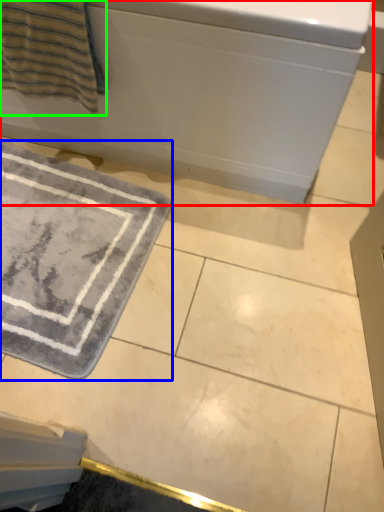
Question: Which is farther away from bath (highlighted by a red box)? bath mat (highlighted by a blue box) or beach towel (highlighted by a green box)?

Choices:
 (A) bath mat
 (B) beach towel

Answer: (A)